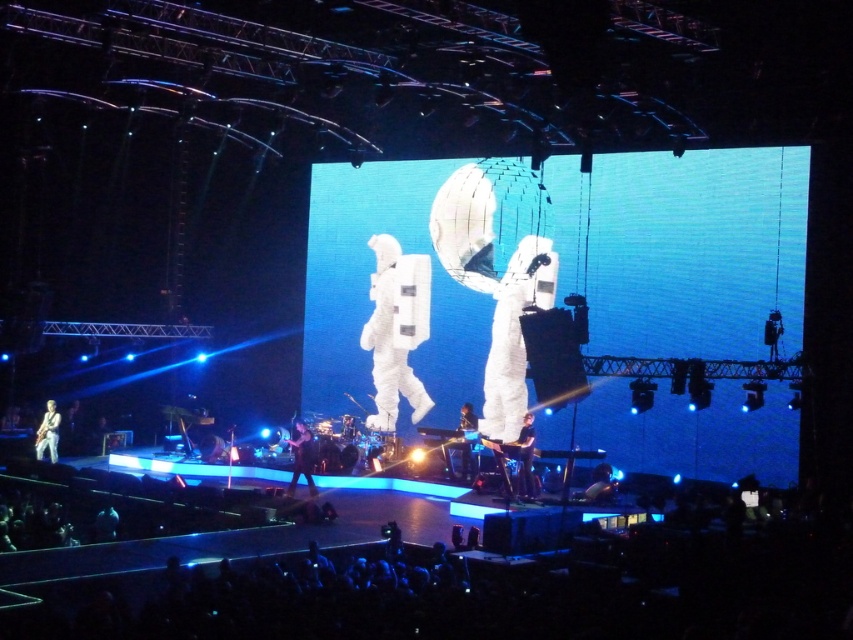
Question: Which point is closer to the camera taking this photo?

Choices:
 (A) (35, 451)
 (B) (294, 435)

Answer: (B)

Question: Which object is the farthest from the shiny metallic helmet at lower center?

Choices:
 (A) metallic silver astronaut at center
 (B) black leather pants at lower center
 (C) shiny black guitar at center
 (D) white fabric astronaut at center

Answer: (D)

Question: Can you confirm if light brown leather guitar at lower left is thinner than metallic silver astronaut at center?

Choices:
 (A) yes
 (B) no

Answer: (B)

Question: Considering the relative positions of black leather jacket at center and metallic silver astronaut at center in the image provided, where is black leather jacket at center located with respect to metallic silver astronaut at center?

Choices:
 (A) left
 (B) right

Answer: (A)

Question: Considering the real-world distances, which object is farthest from the white fabric astronaut at center?

Choices:
 (A) black leather jacket at center
 (B) shiny black guitar at center

Answer: (B)

Question: Is white fabric astronaut at center in front of shiny metallic helmet at lower center?

Choices:
 (A) yes
 (B) no

Answer: (B)